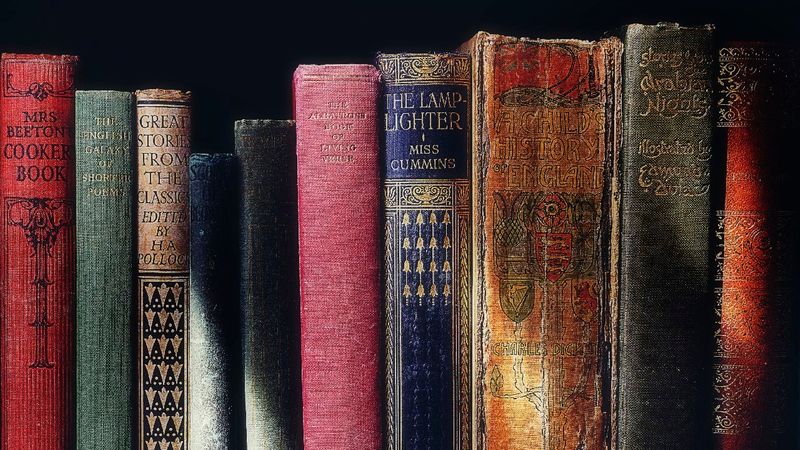
Image resolution: width=800 pixels, height=450 pixels. Identify the location of books. (25, 224), (114, 248), (176, 250), (214, 254), (282, 262), (354, 255), (438, 254), (530, 255), (661, 259), (742, 255).